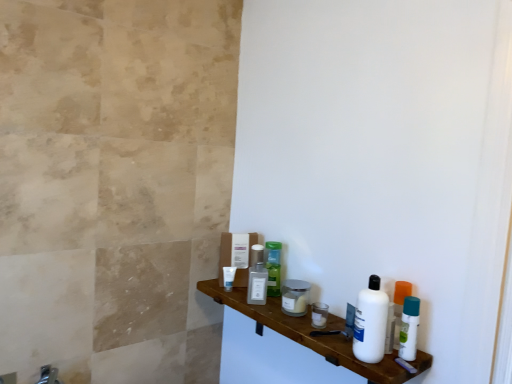
Question: Looking at their shapes, would you say brushed metal faucet at lower left is wider or thinner than satin silver mouthwash at center, which appears as the 1th mouthwash when viewed from the left?

Choices:
 (A) thin
 (B) wide

Answer: (B)

Question: Considering the positions of point (52, 377) and point (261, 266), is point (52, 377) closer or farther from the camera than point (261, 266)?

Choices:
 (A) closer
 (B) farther

Answer: (A)

Question: Which is farther from the white matte tube at center, which appears as the 1th toiletry when viewed from the left?

Choices:
 (A) white plastic bottle at right
 (B) green plastic bottle at center, acting as the 2th toiletry starting from the left
 (C) white glossy wood shelf at lower right
 (D) brushed metal faucet at lower left
 (E) metallic silver jar at center, which ranks as the first toiletry in right-to-left order

Answer: (D)

Question: Considering the real-world distances, which object is farthest from the white matte tube at center, acting as the 4th toiletry starting from the front?

Choices:
 (A) brushed metal faucet at lower left
 (B) metallic silver jar at center, marked as the 1th toiletry in a front-to-back arrangement
 (C) white glossy wood shelf at lower right
 (D) white plastic bottle at right
 (E) green plastic bottle at center, acting as the 2th toiletry starting from the back

Answer: (A)